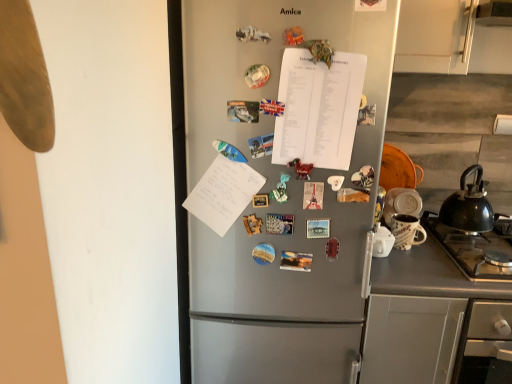
Question: Is gray matte counter at lower right bigger or smaller than white paper at center?

Choices:
 (A) small
 (B) big

Answer: (B)

Question: From the image's perspective, is gray matte counter at lower right located above or below white paper at center?

Choices:
 (A) below
 (B) above

Answer: (A)

Question: Estimate the real-world distances between objects in this image. Which object is farther from the white paper at center?

Choices:
 (A) black matte kettle at right
 (B) matte ceramic mug at right
 (C) gray matte counter at lower right
 (D) satin silver fridge at center

Answer: (A)

Question: Estimate the real-world distances between objects in this image. Which object is closer to the matte ceramic mug at right?

Choices:
 (A) white paper at center
 (B) black matte kettle at right
 (C) gray matte counter at lower right
 (D) satin silver fridge at center

Answer: (B)